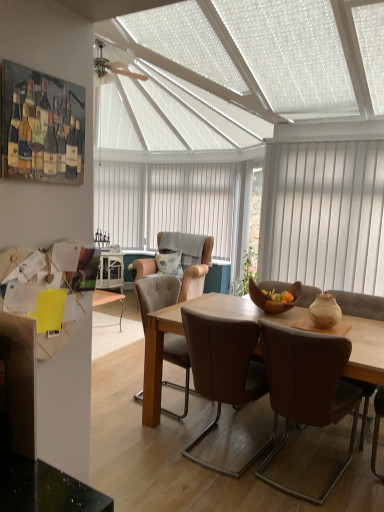
Locate an element on the screen. Image resolution: width=384 pixels, height=512 pixels. vacant area that is in front of brown leather chair at center, the 2th chair positioned from the front is located at coordinates (219, 494).